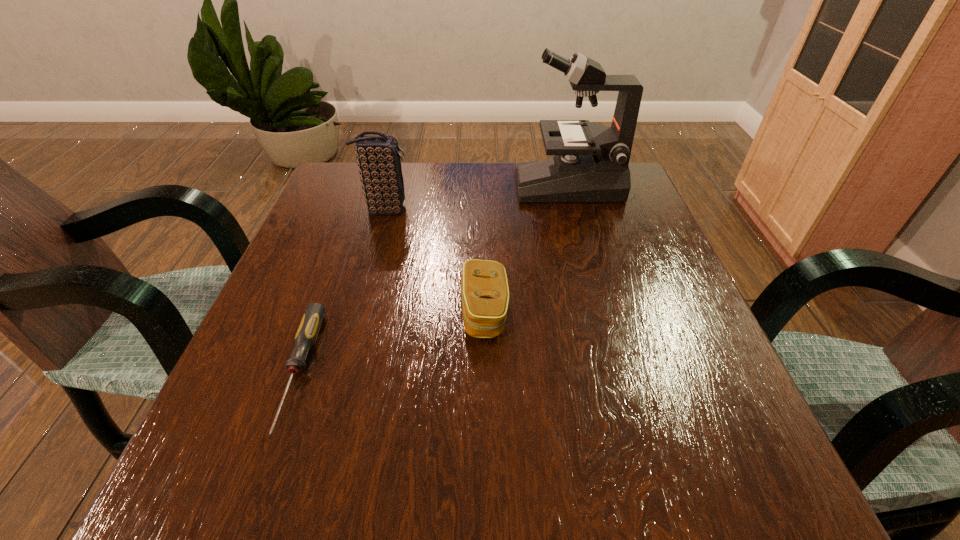
Select which object appears as the closest to the left clutch bag. Please provide its 2D coordinates. Your answer should be formatted as a tuple, i.e. [(x, y)], where the tuple contains the x and y coordinates of a point satisfying the conditions above.

[(484, 288)]

Select which object appears as the second closest to the rightmost object. Please provide its 2D coordinates. Your answer should be formatted as a tuple, i.e. [(x, y)], where the tuple contains the x and y coordinates of a point satisfying the conditions above.

[(484, 288)]

In order to click on free space that satisfies the following two spatial constraints: 1. on the zipper side of the third object from left to right; 2. insert the screwdriver into a screw head in this screenshot , I will do `click(485, 370)`.

This screenshot has height=540, width=960. In order to click on vacant space that satisfies the following two spatial constraints: 1. on the zipper side of the nearer clutch bag; 2. insert the screwdriver into a screw head in this screenshot , I will do `click(485, 370)`.

Find the location of a particular element. This screenshot has width=960, height=540. vacant region that satisfies the following two spatial constraints: 1. with the zip open on the farther clutch bag; 2. insert the screwdriver into a screw head is located at coordinates (341, 370).

The height and width of the screenshot is (540, 960). I want to click on blank space that satisfies the following two spatial constraints: 1. through the eyepieces of the rightmost object; 2. insert the shortest object into a screw head, so click(x=619, y=370).

I want to click on free location that satisfies the following two spatial constraints: 1. on the zipper side of the nearer clutch bag; 2. insert the screwdriver into a screw head, so click(485, 370).

Identify the location of vacant area that satisfies the following two spatial constraints: 1. on the zipper side of the second object from right to left; 2. insert the shortest object into a screw head. (485, 370).

Where is `free location that satisfies the following two spatial constraints: 1. through the eyepieces of the rightmost object; 2. insert the shortest object into a screw head`? The height and width of the screenshot is (540, 960). free location that satisfies the following two spatial constraints: 1. through the eyepieces of the rightmost object; 2. insert the shortest object into a screw head is located at coordinates (619, 370).